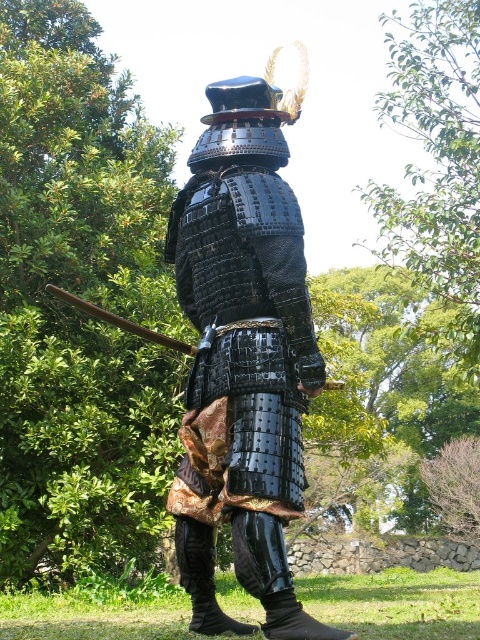
Question: Which point is closer to the camera?

Choices:
 (A) brown wooden staff at left
 (B) glossy black armor at center

Answer: (B)

Question: Which point is farther to the camera?

Choices:
 (A) (72, 298)
 (B) (180, 477)

Answer: (A)

Question: Is the position of glossy black armor at center more distant than that of brown wooden staff at left?

Choices:
 (A) no
 (B) yes

Answer: (A)

Question: Can you confirm if glossy black armor at center is wider than brown wooden staff at left?

Choices:
 (A) no
 (B) yes

Answer: (A)

Question: Can you confirm if glossy black armor at center is positioned below brown wooden staff at left?

Choices:
 (A) no
 (B) yes

Answer: (A)